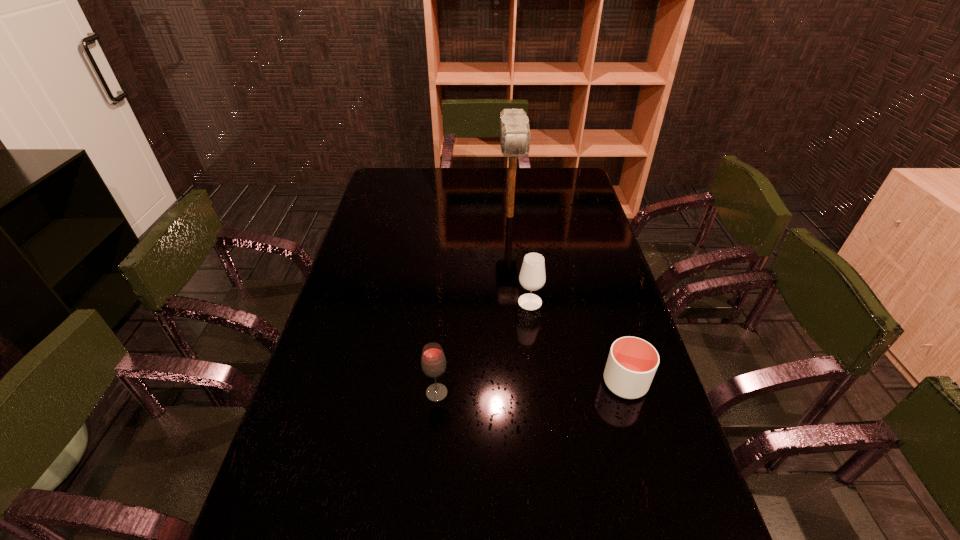
At what (x,y) coordinates should I click in order to perform the action: click on vacant region that satisfies the following two spatial constraints: 1. on the striking face of the right glass drink container; 2. on the left side of the farthest object. Please return your answer as a coordinate pair (x, y). Looking at the image, I should click on (518, 302).

Identify the location of free spot that satisfies the following two spatial constraints: 1. on the front side of the shortest object; 2. on the left side of the farther glass drink container. This screenshot has height=540, width=960. (540, 383).

This screenshot has height=540, width=960. In order to click on blank space that satisfies the following two spatial constraints: 1. on the striking face of the rightmost object; 2. on the right side of the tallest object in this screenshot , I will do `click(525, 383)`.